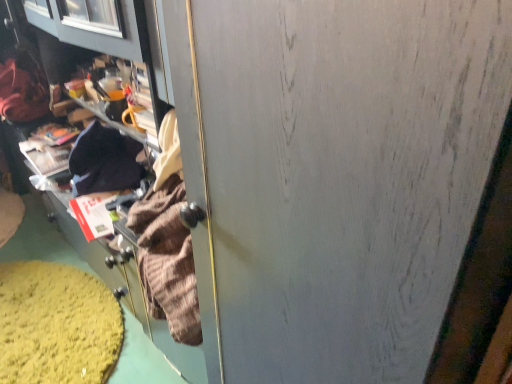
Question: Should I look upward or downward to see cardboard box at lower left?

Choices:
 (A) down
 (B) up

Answer: (A)

Question: Considering the relative sizes of velvet-like brown sweater at left and cardboard box at lower left in the image provided, is velvet-like brown sweater at left thinner than cardboard box at lower left?

Choices:
 (A) no
 (B) yes

Answer: (B)

Question: Does velvet-like brown sweater at left have a greater height compared to cardboard box at lower left?

Choices:
 (A) yes
 (B) no

Answer: (A)

Question: Considering the relative sizes of velvet-like brown sweater at left and cardboard box at lower left in the image provided, is velvet-like brown sweater at left bigger than cardboard box at lower left?

Choices:
 (A) yes
 (B) no

Answer: (A)

Question: Is velvet-like brown sweater at left not near cardboard box at lower left?

Choices:
 (A) no
 (B) yes

Answer: (A)

Question: Is velvet-like brown sweater at left outside cardboard box at lower left?

Choices:
 (A) no
 (B) yes

Answer: (B)

Question: Is velvet-like brown sweater at left in front of cardboard box at lower left?

Choices:
 (A) no
 (B) yes

Answer: (A)

Question: Can you confirm if cardboard box at lower left is thinner than velvet-like brown sweater at left?

Choices:
 (A) no
 (B) yes

Answer: (A)

Question: Can you confirm if cardboard box at lower left is smaller than velvet-like brown sweater at left?

Choices:
 (A) yes
 (B) no

Answer: (A)

Question: Considering the relative sizes of cardboard box at lower left and velvet-like brown sweater at left in the image provided, is cardboard box at lower left shorter than velvet-like brown sweater at left?

Choices:
 (A) yes
 (B) no

Answer: (A)

Question: Can you confirm if cardboard box at lower left is positioned to the right of velvet-like brown sweater at left?

Choices:
 (A) yes
 (B) no

Answer: (A)

Question: Does cardboard box at lower left have a greater width compared to velvet-like brown sweater at left?

Choices:
 (A) no
 (B) yes

Answer: (B)

Question: From the image's perspective, does cardboard box at lower left appear higher than velvet-like brown sweater at left?

Choices:
 (A) no
 (B) yes

Answer: (A)

Question: From their relative heights in the image, would you say velvet-like brown sweater at left is taller or shorter than cardboard box at lower left?

Choices:
 (A) short
 (B) tall

Answer: (B)